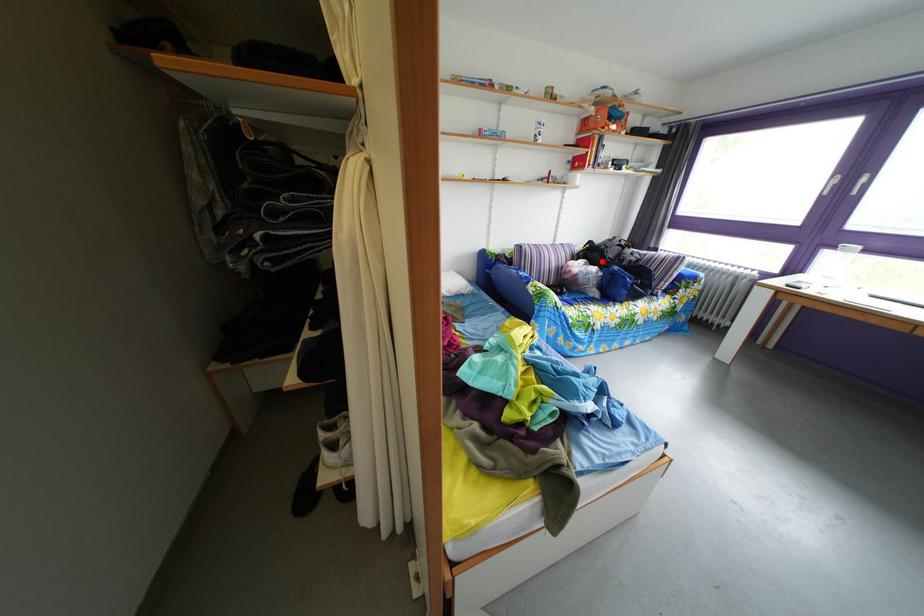
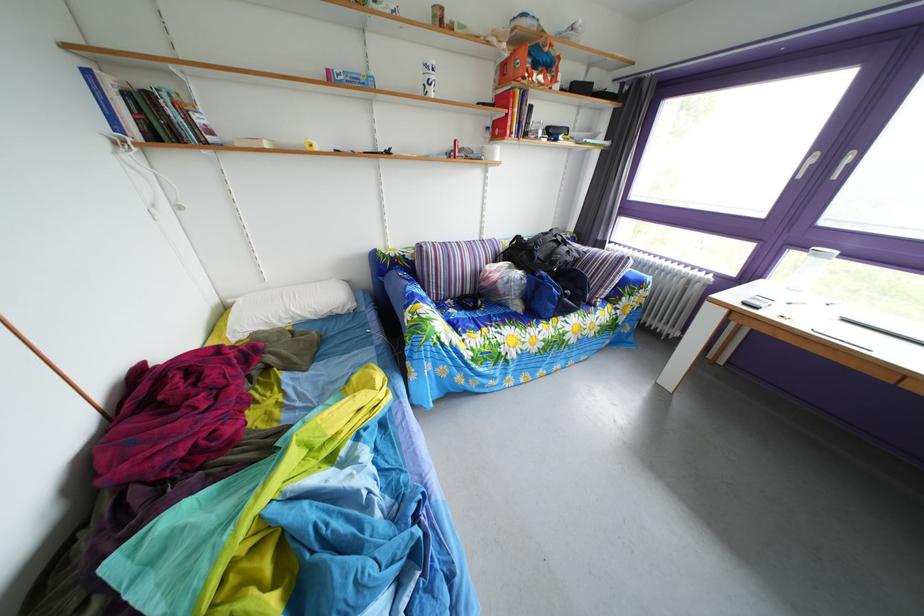
Where in the second image is the point corresponding to the highlighted location from the first image?

(529, 261)